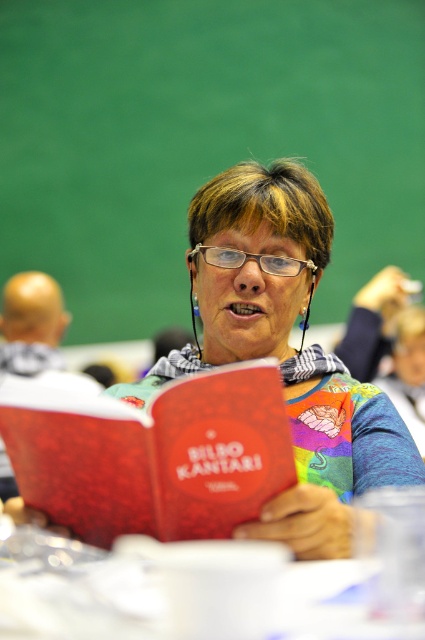
Question: Is matte red book at center positioned before red matte book at center?

Choices:
 (A) no
 (B) yes

Answer: (A)

Question: Does red matte book at center come in front of transparent plastic glasses at center?

Choices:
 (A) no
 (B) yes

Answer: (B)

Question: Which object is closer to the camera taking this photo?

Choices:
 (A) red matte book at center
 (B) matte red book at center

Answer: (A)

Question: Which point appears farthest from the camera in this image?

Choices:
 (A) (297, 262)
 (B) (214, 468)

Answer: (A)

Question: Considering the real-world distances, which object is closest to the matte red book at center?

Choices:
 (A) red matte book at center
 (B) transparent plastic glasses at center

Answer: (B)

Question: Is matte red book at center further to camera compared to transparent plastic glasses at center?

Choices:
 (A) yes
 (B) no

Answer: (B)